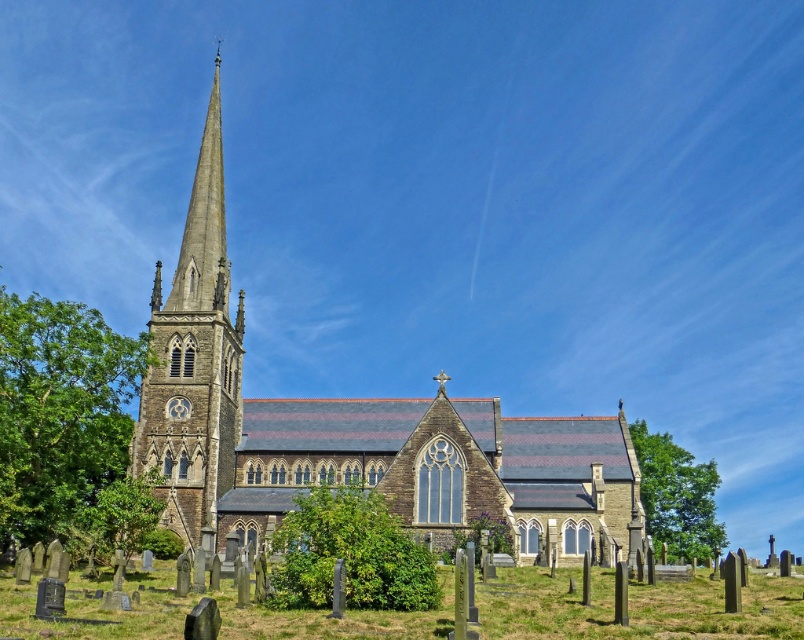
You are standing in front of the church and want to walk from the green leafy tree at left to the green leafy bush at center. Which direction should you move relative to the church?

You should move towards the church to reach the green leafy bush at center from the green leafy tree at left since the tree is closer to you and the bush is further away from the church.

You are standing in the graveyard and want to take a photo of the stone church at center without any obstructions. Since the green grass at lower center is in the foreground, will its height interfere with your photo?

The stone church at center is much taller than the green grass at lower center, so the grass will not obstruct the view of the church in your photo.